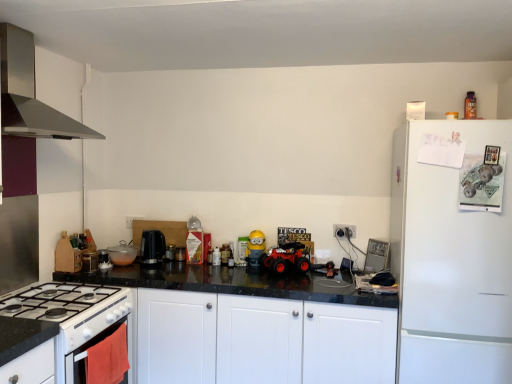
This screenshot has width=512, height=384. In order to click on vacant space in front of metallic black kettle at center, which is the 2th appliance in left-to-right order in this screenshot , I will do `click(181, 266)`.